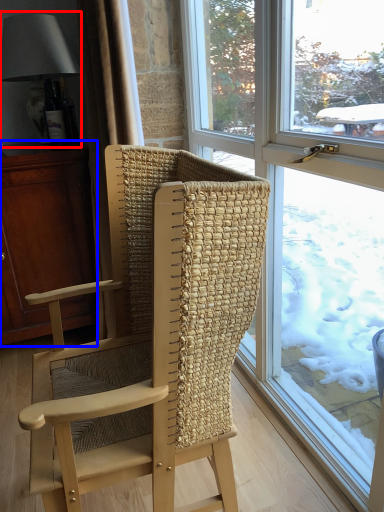
Question: Among these objects, which one is farthest to the camera, lamp (highlighted by a red box) or cabinetry (highlighted by a blue box)?

Choices:
 (A) lamp
 (B) cabinetry

Answer: (A)